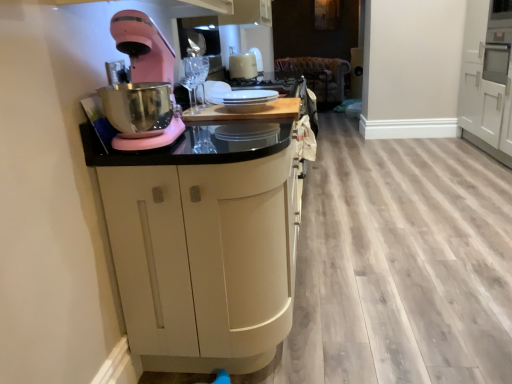
Image resolution: width=512 pixels, height=384 pixels. What are the coordinates of `white glossy kettle at upper center` in the screenshot? It's located at (243, 66).

This screenshot has width=512, height=384. I want to click on white glossy plates at center, so click(246, 100).

Measure the distance between white matte cabinet at right, which appears as the first cabinetry when viewed from the back, and camera.

A distance of 3.87 meters exists between white matte cabinet at right, which appears as the first cabinetry when viewed from the back, and camera.

This screenshot has width=512, height=384. What are the coordinates of `wooden at center` in the screenshot? It's located at (247, 113).

Considering the relative sizes of pink matte stand mixer at left and wooden at center in the image provided, is pink matte stand mixer at left bigger than wooden at center?

Yes.

What are the coordinates of `counter top located underneath the pink matte stand mixer at left (from a real-world perspective)` in the screenshot? It's located at (247, 113).

Is pink matte stand mixer at left turned away from wooden at center?

Absolutely, pink matte stand mixer at left is directed away from wooden at center.

Is pink matte stand mixer at left inside the boundaries of wooden at center, or outside?

pink matte stand mixer at left is outside wooden at center.

Is white matte cabinet at right, arranged as the second cabinetry when viewed from the left, situated inside pink matte stand mixer at left or outside?

white matte cabinet at right, arranged as the second cabinetry when viewed from the left, is spatially situated outside pink matte stand mixer at left.

Which is in front, white matte cabinet at right, placed as the second cabinetry when sorted from front to back, or pink matte stand mixer at left?

pink matte stand mixer at left is more forward.

Would you say white matte cabinet at right, placed as the second cabinetry when sorted from front to back, is to the left or to the right of pink matte stand mixer at left in the picture?

Based on their positions, white matte cabinet at right, placed as the second cabinetry when sorted from front to back, is located to the right of pink matte stand mixer at left.

Who is smaller, white matte cabinet at right, arranged as the second cabinetry when viewed from the left, or pink matte stand mixer at left?

pink matte stand mixer at left is smaller.

Considering the relative sizes of white glossy plates at center and white matte cabinet at right, marked as the first cabinetry in a right-to-left arrangement, in the image provided, is white glossy plates at center taller than white matte cabinet at right, marked as the first cabinetry in a right-to-left arrangement,?

In fact, white glossy plates at center may be shorter than white matte cabinet at right, marked as the first cabinetry in a right-to-left arrangement.

Considering the relative positions of white glossy plates at center and white matte cabinet at right, arranged as the second cabinetry when viewed from the left, in the image provided, is white glossy plates at center to the left of white matte cabinet at right, arranged as the second cabinetry when viewed from the left, from the viewer's perspective?

Correct, you'll find white glossy plates at center to the left of white matte cabinet at right, arranged as the second cabinetry when viewed from the left.

Which of these two, white glossy plates at center or white matte cabinet at right, arranged as the second cabinetry when viewed from the left, is smaller?

white glossy plates at center.

Is point (220, 97) positioned before point (468, 115)?

Yes, it is in front of point (468, 115).

Considering the sizes of objects white matte cabinet at right, marked as the first cabinetry in a right-to-left arrangement, and wooden at center in the image provided, who is shorter, white matte cabinet at right, marked as the first cabinetry in a right-to-left arrangement, or wooden at center?

With less height is wooden at center.

From a real-world perspective, is white matte cabinet at right, which appears as the first cabinetry when viewed from the back, below wooden at center?

Indeed, from a real-world perspective, white matte cabinet at right, which appears as the first cabinetry when viewed from the back, is positioned beneath wooden at center.

Is white matte cabinet at right, which appears as the first cabinetry when viewed from the back, directly adjacent to wooden at center?

No, white matte cabinet at right, which appears as the first cabinetry when viewed from the back, is not in contact with wooden at center.

Is point (501, 83) less distant than point (282, 120)?

No.

Are white matte cabinet at right, marked as the first cabinetry in a right-to-left arrangement, and white glossy plates at center making contact?

No, white matte cabinet at right, marked as the first cabinetry in a right-to-left arrangement, is not touching white glossy plates at center.

Considering the relative positions of white matte cabinet at right, arranged as the second cabinetry when viewed from the left, and white glossy plates at center in the image provided, is white matte cabinet at right, arranged as the second cabinetry when viewed from the left, to the left or to the right of white glossy plates at center?

Clearly, white matte cabinet at right, arranged as the second cabinetry when viewed from the left, is on the right of white glossy plates at center in the image.

Between white matte cabinet at right, marked as the first cabinetry in a right-to-left arrangement, and white glossy plates at center, which one has larger size?

Bigger between the two is white matte cabinet at right, marked as the first cabinetry in a right-to-left arrangement.

Identify the location of appliance below the white matte cabinet at right, which appears as the first cabinetry when viewed from the back (from the image's perspective). This screenshot has height=384, width=512. (246, 100).

Considering the relative positions of white matte cabinet at right, placed as the second cabinetry when sorted from front to back, and white glossy kettle at upper center in the image provided, is white matte cabinet at right, placed as the second cabinetry when sorted from front to back, to the left of white glossy kettle at upper center from the viewer's perspective?

Incorrect, white matte cabinet at right, placed as the second cabinetry when sorted from front to back, is not on the left side of white glossy kettle at upper center.

From the image's perspective, is white matte cabinet at right, marked as the first cabinetry in a right-to-left arrangement, located above or below white glossy kettle at upper center?

Based on their image positions, white matte cabinet at right, marked as the first cabinetry in a right-to-left arrangement, is located beneath white glossy kettle at upper center.

Considering the relative sizes of white matte cabinet at right, placed as the second cabinetry when sorted from front to back, and white glossy kettle at upper center in the image provided, is white matte cabinet at right, placed as the second cabinetry when sorted from front to back, bigger than white glossy kettle at upper center?

Indeed, white matte cabinet at right, placed as the second cabinetry when sorted from front to back, has a larger size compared to white glossy kettle at upper center.

How different are the orientations of wooden at center and pink matte stand mixer at left in degrees?

There is a 90.3-degree angle between the facing directions of wooden at center and pink matte stand mixer at left.

Does wooden at center turn towards pink matte stand mixer at left?

No, wooden at center does not turn towards pink matte stand mixer at left.

From the image's perspective, who appears lower, wooden at center or pink matte stand mixer at left?

pink matte stand mixer at left is shown below in the image.

Locate an element on the screen. home appliance located in front of the wooden at center is located at coordinates (141, 86).

At what (x,y) coordinates should I click in order to perform the action: click on home appliance below the white matte cabinet at right, which appears as the first cabinetry when viewed from the back (from the image's perspective). Please return your answer as a coordinate pair (x, y). The width and height of the screenshot is (512, 384). Looking at the image, I should click on (141, 86).

When comparing their distances from white matte cabinet at right, which appears as the first cabinetry when viewed from the back, does white glossy plates at center or matte black cabinet at center, which is the 1th cabinetry in left-to-right order, seem closer?

white glossy plates at center lies closer to white matte cabinet at right, which appears as the first cabinetry when viewed from the back, than the other object.

Which object lies nearer to the anchor point white glossy plates at center, white glossy kettle at upper center or pink matte stand mixer at left?

pink matte stand mixer at left is closer to white glossy plates at center.

Considering their positions, is pink matte stand mixer at left positioned closer to white glossy kettle at upper center than matte black cabinet at center, the second cabinetry positioned from the right?

matte black cabinet at center, the second cabinetry positioned from the right, lies closer to white glossy kettle at upper center than the other object.

Considering their positions, is matte black cabinet at center, which is the second cabinetry in back-to-front order, positioned closer to white matte cabinet at right, which appears as the first cabinetry when viewed from the back, than white glossy kettle at upper center?

white glossy kettle at upper center is positioned closer to the anchor white matte cabinet at right, which appears as the first cabinetry when viewed from the back.

Based on their spatial positions, is wooden at center or white glossy kettle at upper center further from matte black cabinet at center, which is the 1th cabinetry in left-to-right order?

Based on the image, white glossy kettle at upper center appears to be further to matte black cabinet at center, which is the 1th cabinetry in left-to-right order.

Looking at the image, which one is located closer to white glossy plates at center, matte black cabinet at center, which is the second cabinetry in back-to-front order, or white glossy kettle at upper center?

The object closer to white glossy plates at center is matte black cabinet at center, which is the second cabinetry in back-to-front order.

Looking at the image, which one is located further to wooden at center, white matte cabinet at right, which appears as the first cabinetry when viewed from the back, or white glossy kettle at upper center?

Answer: white matte cabinet at right, which appears as the first cabinetry when viewed from the back, is further to wooden at center.

From the image, which object appears to be farther from white glossy plates at center, matte black cabinet at center, which is the 1th cabinetry in left-to-right order, or pink matte stand mixer at left?

matte black cabinet at center, which is the 1th cabinetry in left-to-right order, lies further to white glossy plates at center than the other object.

Locate an element on the screen. appliance situated between white glossy kettle at upper center and white matte cabinet at right, which appears as the first cabinetry when viewed from the back, from left to right is located at coordinates (246, 100).

What are the coordinates of `cabinetry between pink matte stand mixer at left and wooden at center along the z-axis` in the screenshot? It's located at (203, 244).

Where is `appliance between pink matte stand mixer at left and wooden at center in the front-back direction`? The width and height of the screenshot is (512, 384). appliance between pink matte stand mixer at left and wooden at center in the front-back direction is located at coordinates (246, 100).

At what (x,y) coordinates should I click in order to perform the action: click on counter top located between pink matte stand mixer at left and white matte cabinet at right, which appears as the first cabinetry when viewed from the back, in the left-right direction. Please return your answer as a coordinate pair (x, y). Looking at the image, I should click on [x=247, y=113].